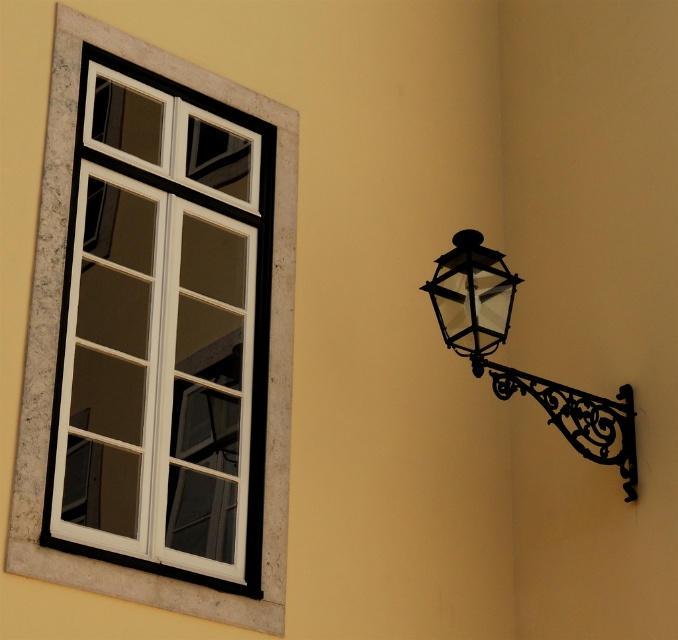
You are standing in front of the wall with the window and lantern. There is a point marked at coordinates (x=163, y=332). Which object does this point belong to?

The point at coordinates (x=163, y=332) belongs to the white matte window at left.

You are standing in front of the wall with the white matte window at left and the black wrought iron lantern at right. Which object is located higher up on the wall?

The white matte window at left is positioned over the black wrought iron lantern at right, so it is higher up on the wall.